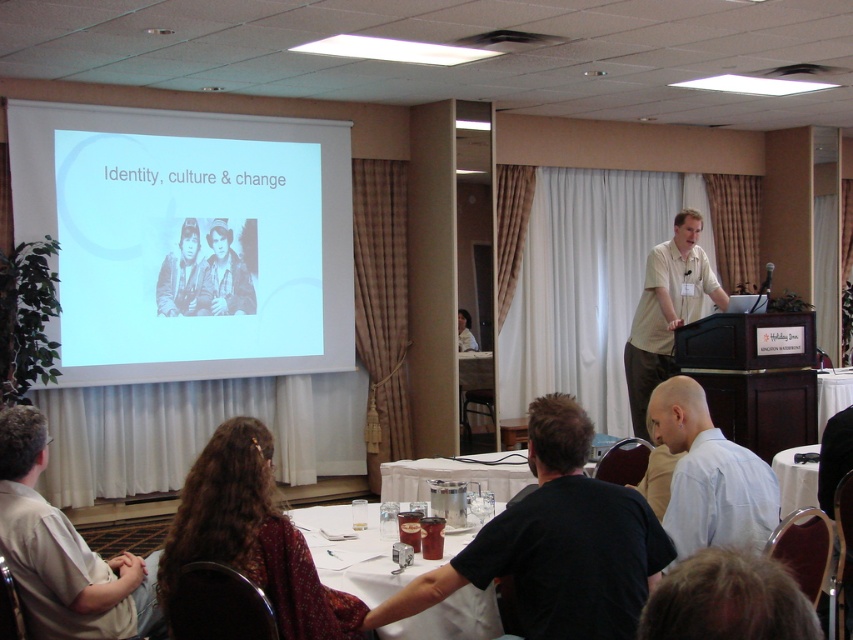
Question: Which of the following is the farthest from the observer?

Choices:
 (A) (450, 561)
 (B) (704, 260)

Answer: (B)

Question: Does white glossy table at lower center lie behind white plastic table at center?

Choices:
 (A) yes
 (B) no

Answer: (B)

Question: Does black matte shirt at lower center appear under light blue shirt at lower right?

Choices:
 (A) yes
 (B) no

Answer: (A)

Question: Which object is positioned closest to the dark brown hair at lower left?

Choices:
 (A) light blue shirt at lower right
 (B) grayscale photo of two people at center
 (C) white fabric table at lower right

Answer: (A)

Question: Does white plastic table at center have a lesser width compared to grayscale photo of two people at center?

Choices:
 (A) yes
 (B) no

Answer: (B)

Question: Which point is farther from the camera taking this photo?

Choices:
 (A) (22, 560)
 (B) (350, 589)
 (C) (521, 602)
 (D) (692, 436)

Answer: (D)